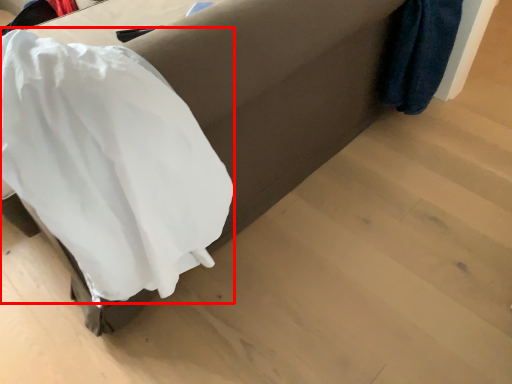
Question: From the image's perspective, what is the correct spatial relationship of clothing (annotated by the red box) in relation to furniture?

Choices:
 (A) below
 (B) above

Answer: (A)